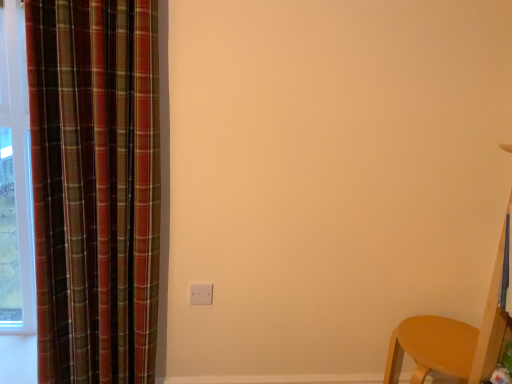
Question: Is plaid fabric curtain at left outside of white matte electric outlet at center?

Choices:
 (A) no
 (B) yes

Answer: (B)

Question: Can you confirm if plaid fabric curtain at left is shorter than white matte electric outlet at center?

Choices:
 (A) no
 (B) yes

Answer: (A)

Question: Considering the relative positions of plaid fabric curtain at left and white matte electric outlet at center in the image provided, is plaid fabric curtain at left to the left of white matte electric outlet at center from the viewer's perspective?

Choices:
 (A) no
 (B) yes

Answer: (B)

Question: From a real-world perspective, is plaid fabric curtain at left physically above white matte electric outlet at center?

Choices:
 (A) no
 (B) yes

Answer: (B)

Question: Is plaid fabric curtain at left oriented towards white matte electric outlet at center?

Choices:
 (A) no
 (B) yes

Answer: (A)

Question: From the image's perspective, is plaid fabric curtain at left on top of white matte electric outlet at center?

Choices:
 (A) yes
 (B) no

Answer: (A)

Question: Is matte wood chair at lower right further to camera compared to white matte electric outlet at center?

Choices:
 (A) no
 (B) yes

Answer: (A)

Question: Is matte wood chair at lower right outside white matte electric outlet at center?

Choices:
 (A) no
 (B) yes

Answer: (B)

Question: Is matte wood chair at lower right with white matte electric outlet at center?

Choices:
 (A) yes
 (B) no

Answer: (B)

Question: Is matte wood chair at lower right facing towards white matte electric outlet at center?

Choices:
 (A) no
 (B) yes

Answer: (B)

Question: From a real-world perspective, is matte wood chair at lower right located beneath white matte electric outlet at center?

Choices:
 (A) no
 (B) yes

Answer: (B)

Question: Can you confirm if matte wood chair at lower right is shorter than white matte electric outlet at center?

Choices:
 (A) no
 (B) yes

Answer: (A)

Question: Is white matte electric outlet at center positioned beyond the bounds of plaid fabric curtain at left?

Choices:
 (A) yes
 (B) no

Answer: (A)